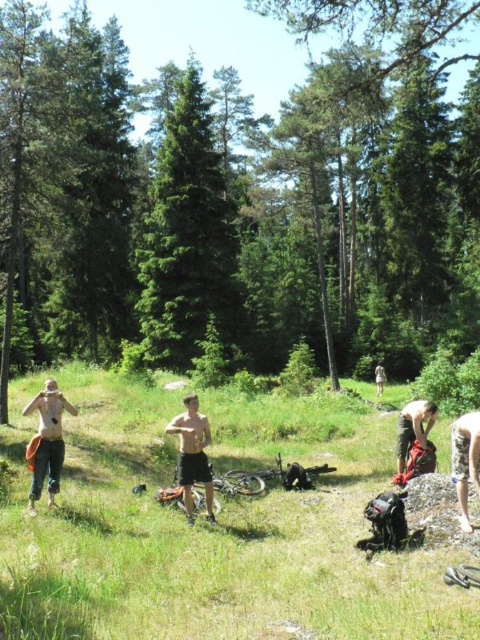
Is green leafy tree at center thinner than green matte tree at center?

In fact, green leafy tree at center might be wider than green matte tree at center.

Can you confirm if green leafy tree at center is taller than green matte tree at center?

Yes, green leafy tree at center is taller than green matte tree at center.

Is point (300, 205) in front of point (212, 301)?

No.

Image resolution: width=480 pixels, height=640 pixels. Find the location of `green leafy tree at center`. green leafy tree at center is located at coordinates (242, 196).

Between green grassy field at center and green matte tree at center, which one appears on the right side from the viewer's perspective?

Positioned to the right is green grassy field at center.

Between point (363, 625) and point (173, 163), which one is positioned in front?

Point (363, 625) is more forward.

Which is behind, point (159, 422) or point (165, 285)?

The point (165, 285) is more distant.

Locate an element on the screen. The height and width of the screenshot is (640, 480). green grassy field at center is located at coordinates (212, 529).

Find the location of a particular element. This screenshot has width=480, height=640. denim pants at left is located at coordinates (47, 442).

Who is lower down, denim pants at left or light brown wooden stick at center?

light brown wooden stick at center is below.

Which is in front, point (23, 413) or point (376, 378)?

Point (23, 413) is in front.

Find the location of a particular element. denim pants at left is located at coordinates (47, 442).